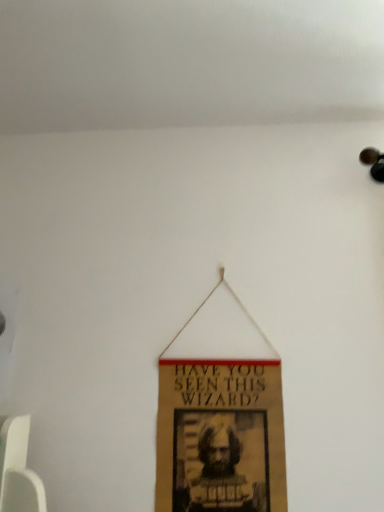
Describe the element at coordinates (220, 436) in the screenshot. The image size is (384, 512). I see `brown cardboard poster at center` at that location.

At what (x,y) coordinates should I click in order to perform the action: click on brown cardboard poster at center. Please return your answer as a coordinate pair (x, y). The image size is (384, 512). Looking at the image, I should click on (220, 436).

Locate an element on the screen. The height and width of the screenshot is (512, 384). brown cardboard poster at center is located at coordinates (220, 436).